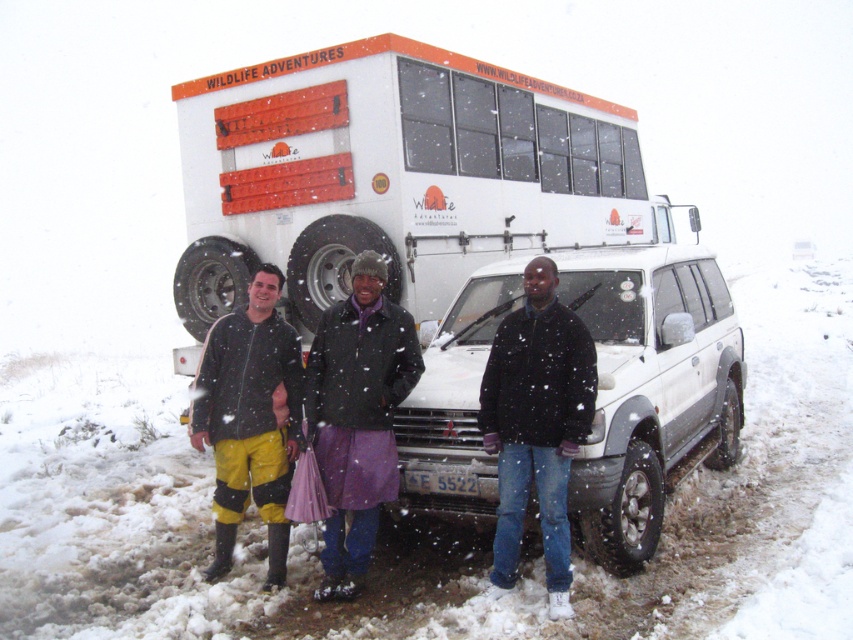
You are standing in the snowy scene and want to take a photo of both the white matte bus at center and the black matte jacket at center. Which object should you focus on first to ensure it appears sharp in the photo?

You should focus on the white matte bus at center first because it is closer to you than the black matte jacket at center, ensuring it will be in focus before adjusting for the jacket.

You are standing at the origin point in the image. Which direction should you move to reach the black matte jacket at center?

The black matte jacket at center is located at coordinates point (537, 424). Since you are at the origin, you should move towards the right and upwards to reach it.

You are planning to take a photo of the white matte bus at center and the black matte jacket at center. Which object should you focus on first if you want to capture both in a single frame without moving the camera?

You should focus on the white matte bus at center first because it is shorter than the black matte jacket at center, so it will fit within the frame more easily.